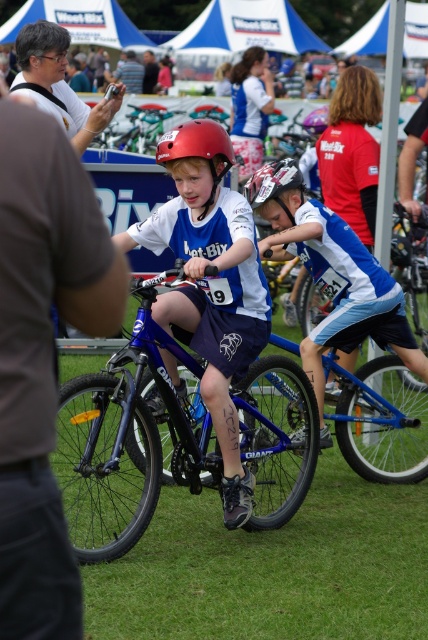
Question: Can you confirm if matte blue jersey at center is thinner than blue jersey at center?

Choices:
 (A) no
 (B) yes

Answer: (B)

Question: Which is farther from the blue metallic bicycle at center?

Choices:
 (A) brown fabric shirt at left
 (B) matte blue jersey at center

Answer: (A)

Question: Is shiny red helmet at center in front of white matte bicycle helmet at center?

Choices:
 (A) yes
 (B) no

Answer: (A)

Question: Which point is farther to the camera?

Choices:
 (A) (74, 278)
 (B) (32, 51)

Answer: (B)

Question: Is blue metallic bicycle at center bigger than matte blue jersey at center?

Choices:
 (A) no
 (B) yes

Answer: (B)

Question: Which of the following is the closest to the observer?

Choices:
 (A) (388, 284)
 (B) (130, 58)
 (C) (142, 88)
 (D) (296, 179)

Answer: (D)